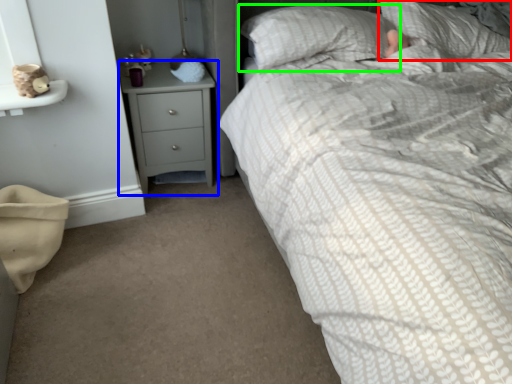
Question: Estimate the real-world distances between objects in this image. Which object is closer to pillow (highlighted by a red box), chest of drawers (highlighted by a blue box) or pillow (highlighted by a green box)?

Choices:
 (A) chest of drawers
 (B) pillow

Answer: (B)